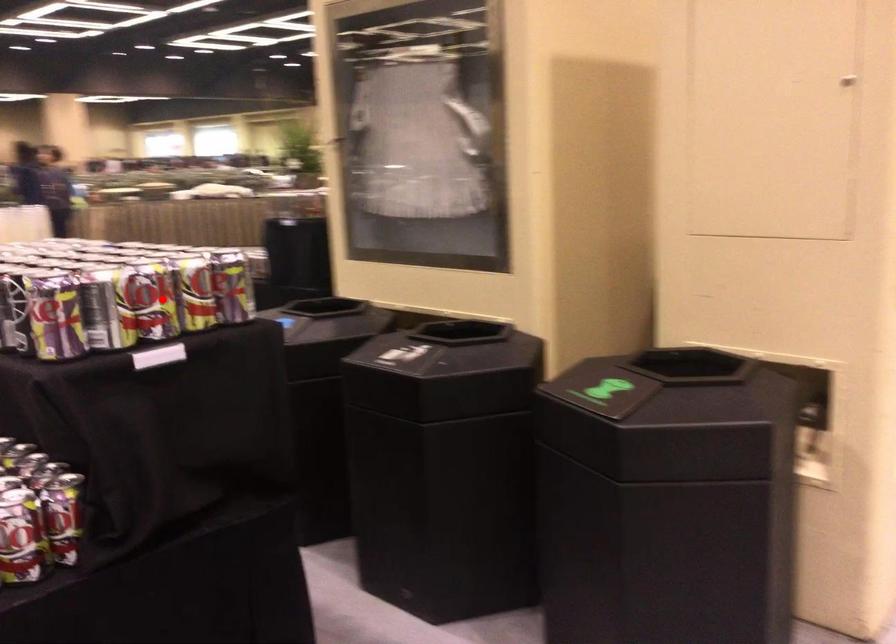
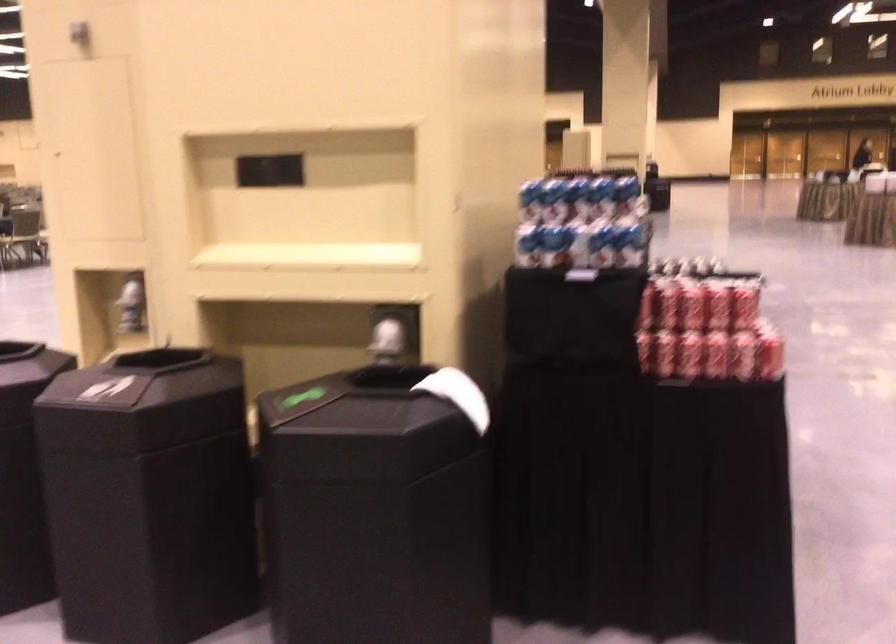
Question: I am providing you with two images of the same scene from different viewpoints. A red point is marked on the first image. Can you still see the location of the red point in image 2?

Choices:
 (A) Yes
 (B) No

Answer: (B)